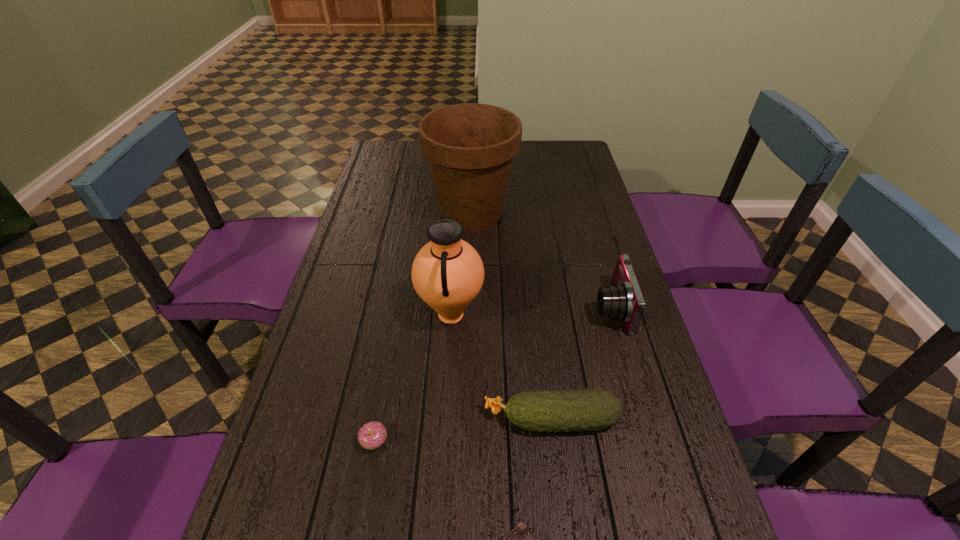
Locate an element on the screen. The height and width of the screenshot is (540, 960). blank space located 0.100m on the front-facing side of the camera is located at coordinates (558, 308).

This screenshot has height=540, width=960. Find the location of `vacant region located 0.350m at the blossom end of the cucumber`. vacant region located 0.350m at the blossom end of the cucumber is located at coordinates (328, 420).

Where is `vacant space located 0.070m at the blossom end of the cucumber`? vacant space located 0.070m at the blossom end of the cucumber is located at coordinates (453, 420).

Where is `vacant space located at the blossom end of the cucumber`? This screenshot has height=540, width=960. vacant space located at the blossom end of the cucumber is located at coordinates (431, 420).

Locate an element on the screen. Image resolution: width=960 pixels, height=540 pixels. vacant area situated on the front of the cupcake is located at coordinates (368, 480).

Identify the location of camera that is at the right edge. (624, 300).

At what (x,y) coordinates should I click in order to perform the action: click on cucumber present at the right edge. Please return your answer as a coordinate pair (x, y). Looking at the image, I should click on (593, 409).

The width and height of the screenshot is (960, 540). In the image, there is a desktop. In order to click on vacant space at the far edge in this screenshot , I will do `click(522, 164)`.

You are a GUI agent. You are given a task and a screenshot of the screen. Output one action in this format:
    pyautogui.click(x=<x>, y=<y>)
    Task: Click on the vacant space at the left edge
    The width and height of the screenshot is (960, 540).
    Given the screenshot: What is the action you would take?
    pyautogui.click(x=377, y=208)

The height and width of the screenshot is (540, 960). In the image, there is a desktop. What are the coordinates of `free space at the right edge` in the screenshot? It's located at (598, 219).